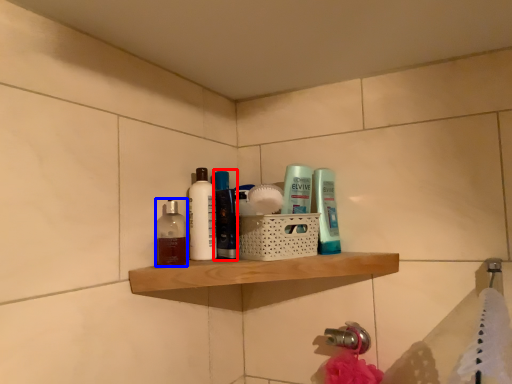
Question: Which object is further to the camera taking this photo, mouthwash (highlighted by a red box) or mouthwash (highlighted by a blue box)?

Choices:
 (A) mouthwash
 (B) mouthwash

Answer: (A)